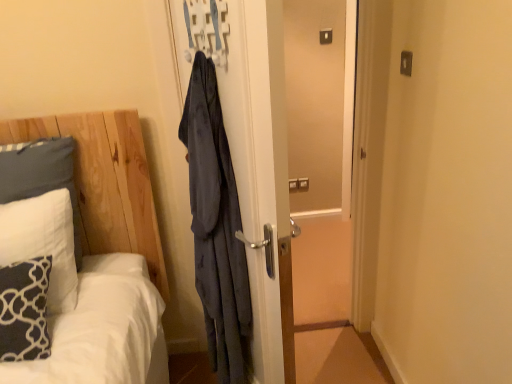
Question: Is matte plastic light switch at upper center in front of or behind white soft pillow at left, positioned as the 1th pillow in back-to-front order, in the image?

Choices:
 (A) front
 (B) behind

Answer: (B)

Question: In terms of size, does matte plastic light switch at upper center appear bigger or smaller than white soft pillow at left, positioned as the 1th pillow in back-to-front order?

Choices:
 (A) big
 (B) small

Answer: (B)

Question: Which of these objects is positioned farthest from the white soft pillow at left, which is the 2th pillow in back-to-front order?

Choices:
 (A) white soft pillow at left, positioned as the 1th pillow in back-to-front order
 (B) dark blue textured pillow at lower left, which ranks as the 3th pillow in back-to-front order
 (C) matte plastic light switch at upper center
 (D) matte blue fabric hanger at upper center

Answer: (C)

Question: Which object is the farthest from the dark blue textured pillow at lower left, which ranks as the 3th pillow in back-to-front order?

Choices:
 (A) matte blue fabric hanger at upper center
 (B) matte plastic light switch at upper center
 (C) white soft pillow at left, which is the 2th pillow in back-to-front order
 (D) white soft pillow at left, which is the third pillow from front to back

Answer: (B)